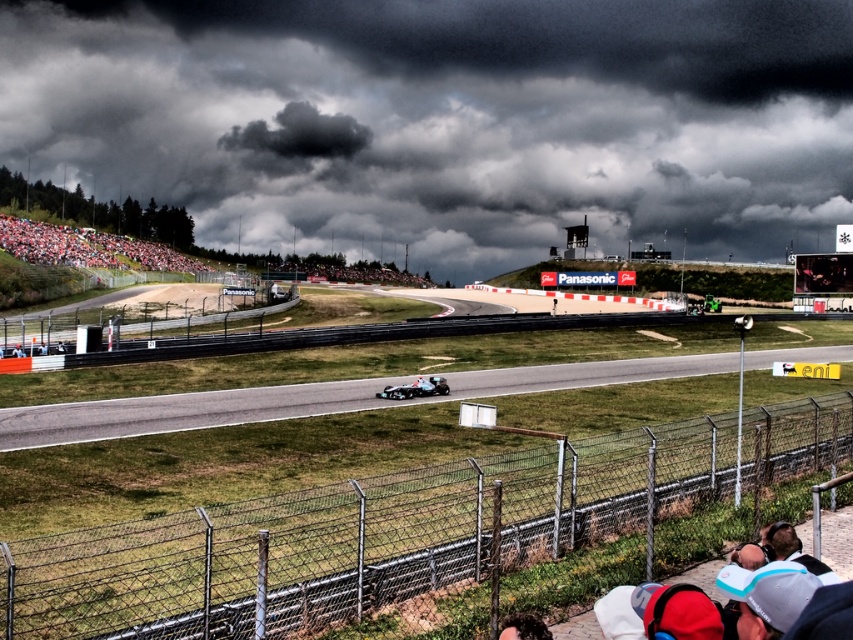
Who is taller, smooth asphalt track at center or silver metallic race car at center?

Standing taller between the two is smooth asphalt track at center.

Who is more forward, (6, 412) or (416, 387)?

Point (6, 412) is more forward.

Find the location of `smooth asphalt track at center`. smooth asphalt track at center is located at coordinates (317, 400).

Does smooth asphalt track at center lie in front of red fabric crowd at left?

Yes, it is in front of red fabric crowd at left.

Between smooth asphalt track at center and red fabric crowd at left, which one appears on the left side from the viewer's perspective?

Positioned to the left is red fabric crowd at left.

Which is in front, point (456, 372) or point (134, 266)?

Point (456, 372) is more forward.

Where is `smooth asphalt track at center`? The height and width of the screenshot is (640, 853). smooth asphalt track at center is located at coordinates (317, 400).

Which is behind, point (563, 109) or point (415, 387)?

Positioned behind is point (563, 109).

Between dark gray cloud at upper center and silver metallic race car at center, which one is positioned higher?

Positioned higher is dark gray cloud at upper center.

The image size is (853, 640). In order to click on dark gray cloud at upper center in this screenshot , I will do `click(445, 120)`.

At what (x,y) coordinates should I click in order to perform the action: click on dark gray cloud at upper center. Please return your answer as a coordinate pair (x, y). This screenshot has width=853, height=640. Looking at the image, I should click on (445, 120).